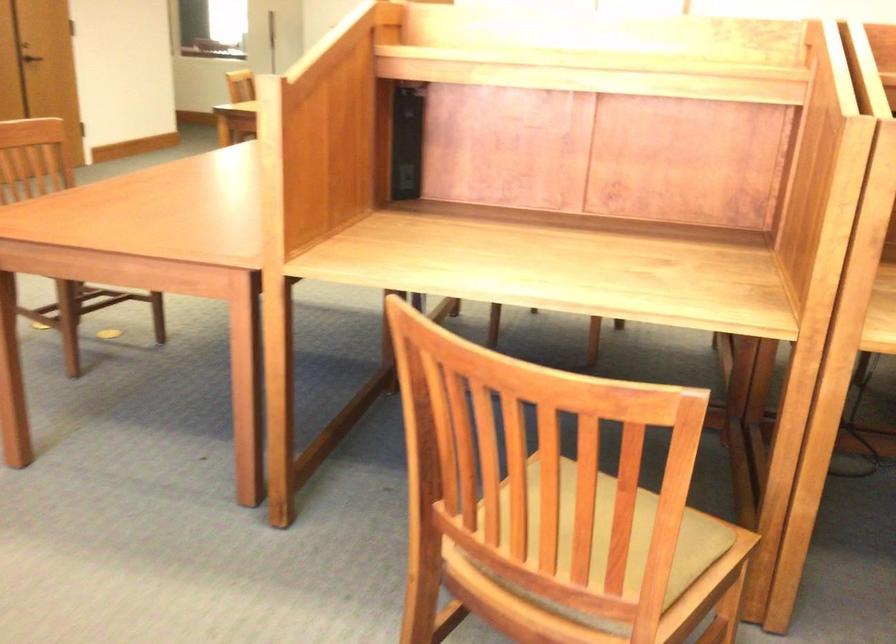
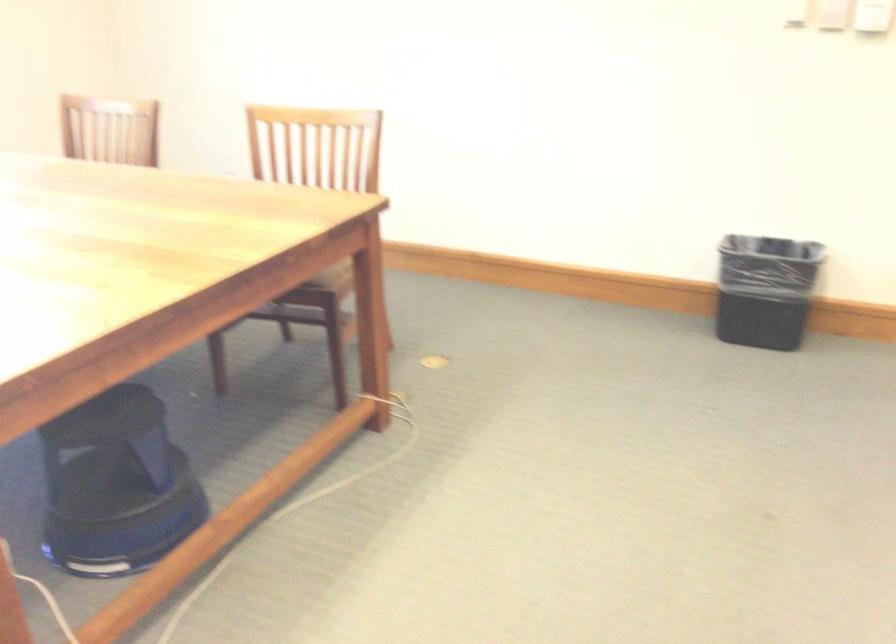
Looking at this image, how did the camera likely rotate?

The rotation direction of the camera is left-down.